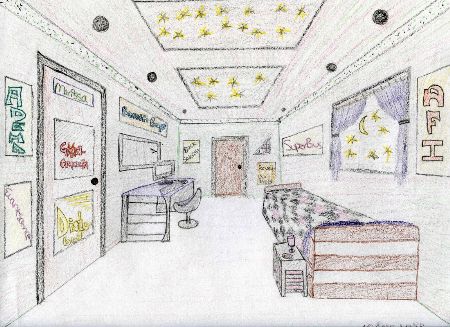
I want to click on doorknob, so click(x=240, y=167).